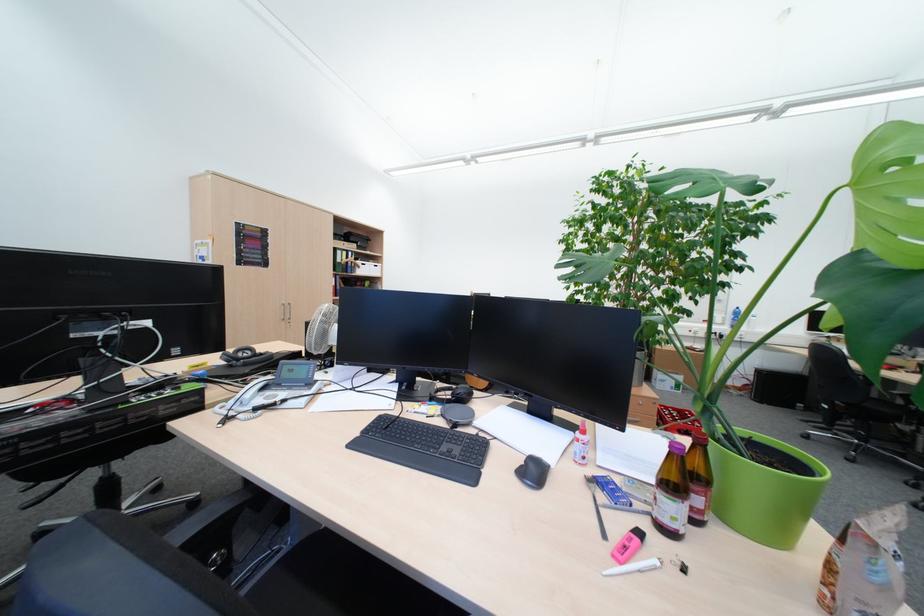
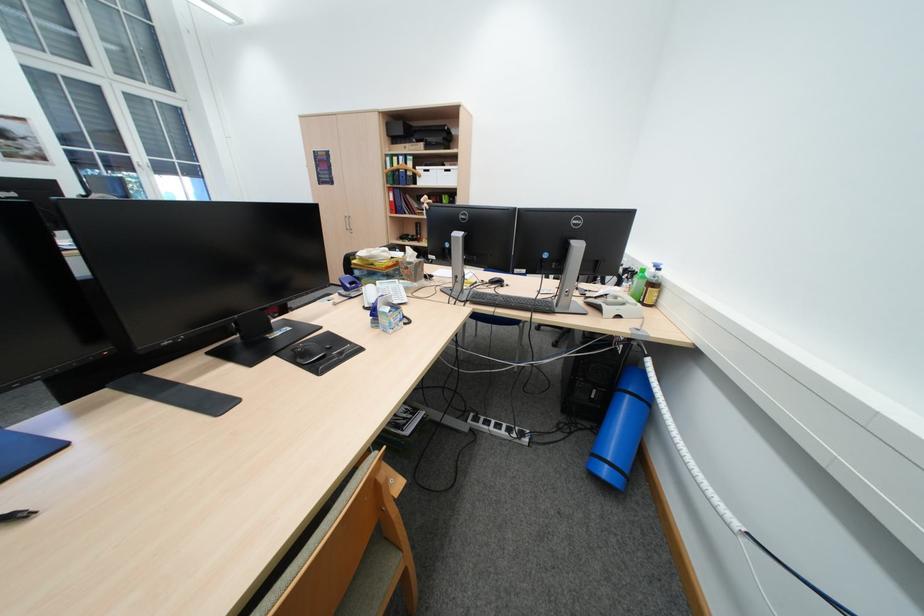
Locate, in the second image, the point that corresponds to the point at 377,270 in the first image.

(442, 179)